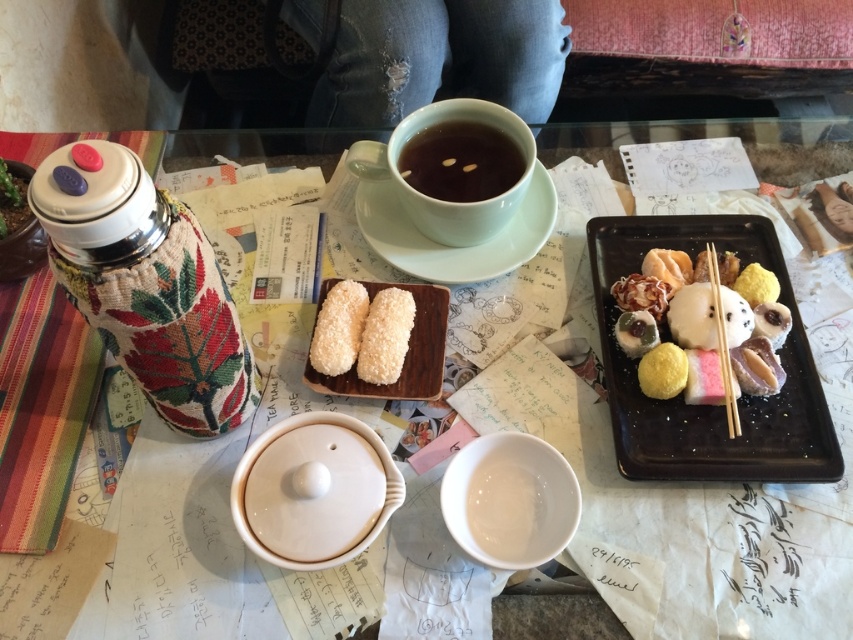
Who is shorter, matte ceramic cup at upper center or slightly translucent brown meat at center?

slightly translucent brown meat at center is shorter.

Which is above, matte ceramic cup at upper center or slightly translucent brown meat at center?

Positioned higher is matte ceramic cup at upper center.

Is point (450, 211) behind point (747, 387)?

Yes, it is.

The height and width of the screenshot is (640, 853). Find the location of `matte ceramic cup at upper center`. matte ceramic cup at upper center is located at coordinates (445, 200).

Who is shorter, white coconut-covered pastry at center or slightly translucent brown meat at center?

Standing shorter between the two is slightly translucent brown meat at center.

Does white coconut-covered pastry at center have a larger size compared to slightly translucent brown meat at center?

Correct, white coconut-covered pastry at center is larger in size than slightly translucent brown meat at center.

In order to click on white coconut-covered pastry at center in this screenshot , I will do `click(405, 352)`.

Locate an element on the screen. white coconut-covered pastry at center is located at coordinates (405, 352).

Who is lower down, smooth white rice cake at center or brown matte cup at upper center?

smooth white rice cake at center is lower down.

The image size is (853, 640). I want to click on smooth white rice cake at center, so click(x=689, y=304).

The image size is (853, 640). Identify the location of smooth white rice cake at center. (689, 304).